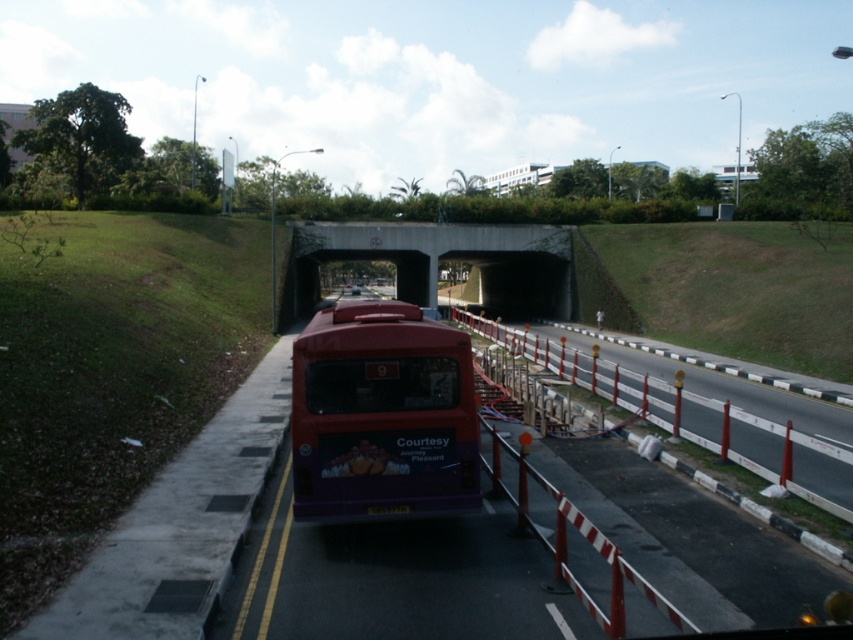
Can you confirm if concrete at center is taller than metallic red barricade at center-right?

Indeed, concrete at center has a greater height compared to metallic red barricade at center-right.

Can you confirm if concrete at center is positioned above metallic red barricade at center-right?

Yes.

Does point (537, 298) come farther from viewer compared to point (555, 509)?

Yes, point (537, 298) is behind point (555, 509).

At what (x,y) coordinates should I click in order to perform the action: click on concrete at center. Please return your answer as a coordinate pair (x, y). The height and width of the screenshot is (640, 853). Looking at the image, I should click on pyautogui.click(x=444, y=259).

Does matte purple bus at center have a larger size compared to metallic red barricade at center-right?

Indeed, matte purple bus at center has a larger size compared to metallic red barricade at center-right.

Who is more forward, (386, 445) or (605, 625)?

Point (605, 625) is more forward.

I want to click on matte purple bus at center, so click(381, 416).

Describe the element at coordinates (381, 416) in the screenshot. I see `matte purple bus at center` at that location.

Can you confirm if matte purple bus at center is shorter than concrete at center?

Yes.

Which is in front, point (410, 371) or point (485, 301)?

Point (410, 371) is more forward.

Where is `matte purple bus at center`? The image size is (853, 640). matte purple bus at center is located at coordinates 381,416.